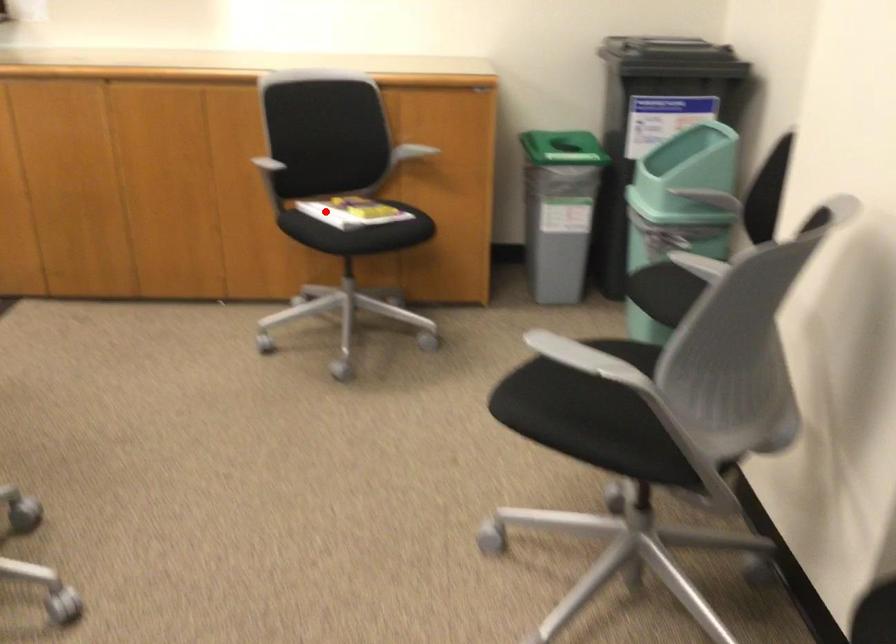
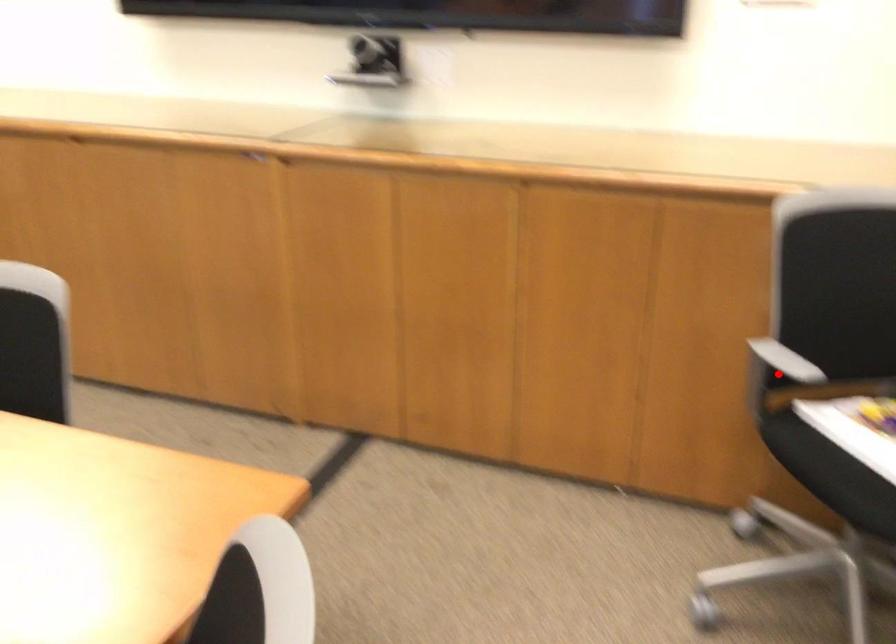
I am providing you with two images of the same scene from different viewpoints. A red point is marked on the first image and another point is marked on the second image. Is the red point in image1 aligned with the point shown in image2?

No